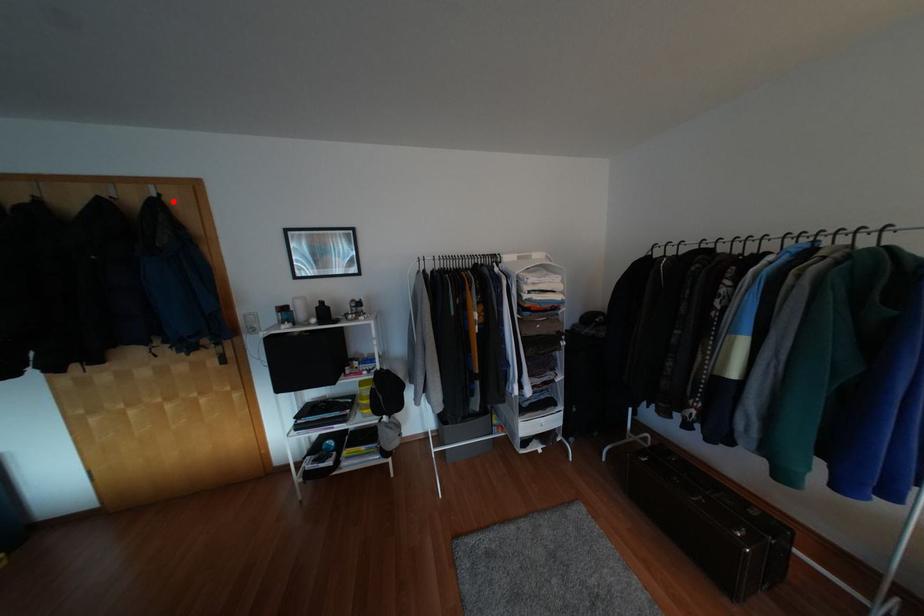
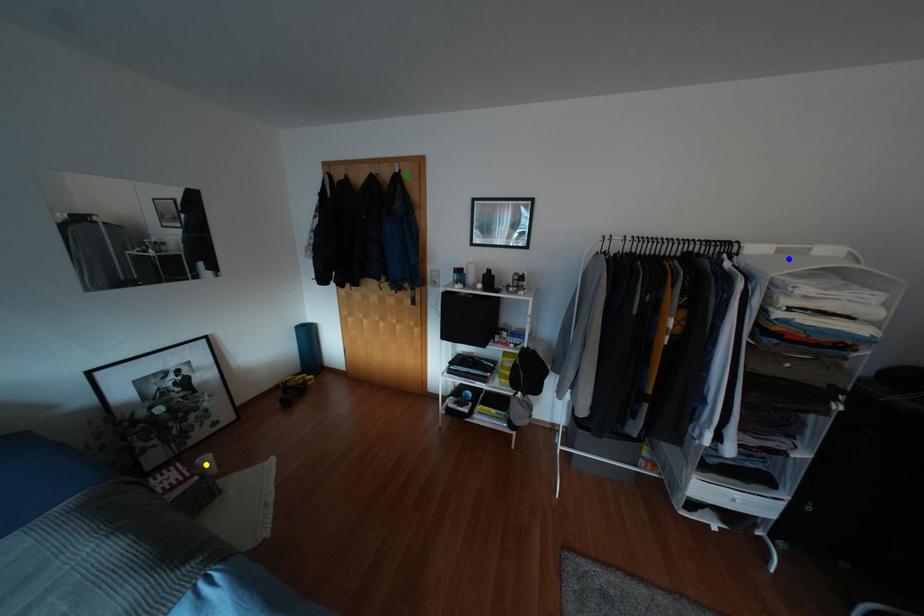
Question: I am providing you with two images of the same scene from different viewpoints. A red point is marked on the first image. You are given multiple points on the second image. Can you choose the point in image 2 that corresponds to the point in image 1?

Choices:
 (A) green point
 (B) blue point
 (C) yellow point

Answer: (A)